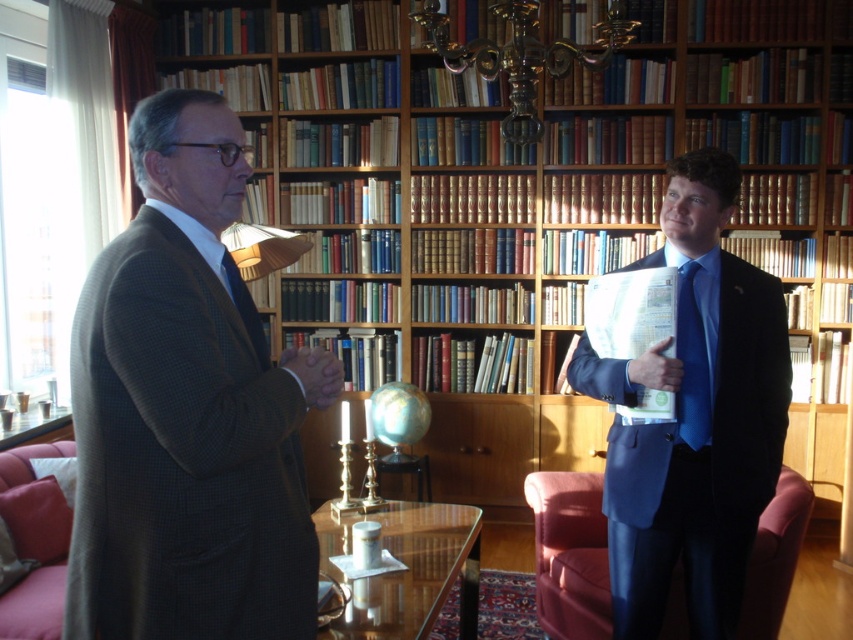
Is point (24, 483) positioned in front of point (688, 307)?

That is False.

From the picture: Does velvet red armchair at lower left appear on the left side of blue silk tie at right?

Indeed, velvet red armchair at lower left is positioned on the left side of blue silk tie at right.

Locate an element on the screen. velvet red armchair at lower left is located at coordinates (33, 541).

Who is positioned more to the right, matte brown suit at left or blue glossy suit at center?

Positioned to the right is blue glossy suit at center.

Can you confirm if matte brown suit at left is bigger than blue glossy suit at center?

Actually, matte brown suit at left might be smaller than blue glossy suit at center.

Between point (310, 572) and point (705, 509), which one is positioned behind?

The point (705, 509) is more distant.

Where is `matte brown suit at left`? matte brown suit at left is located at coordinates (186, 412).

Does blue glossy suit at center appear on the right side of blue silk tie at right?

No, blue glossy suit at center is not to the right of blue silk tie at right.

Is point (695, 516) positioned behind point (676, 308)?

Yes, it is.

This screenshot has width=853, height=640. I want to click on blue glossy suit at center, so click(x=694, y=417).